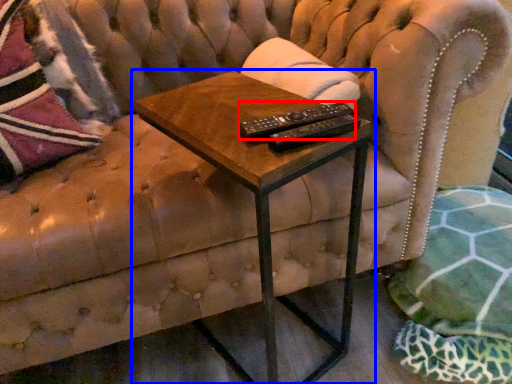
Question: Which of the following is the farthest to the observer, control (highlighted by a red box) or table (highlighted by a blue box)?

Choices:
 (A) control
 (B) table

Answer: (A)